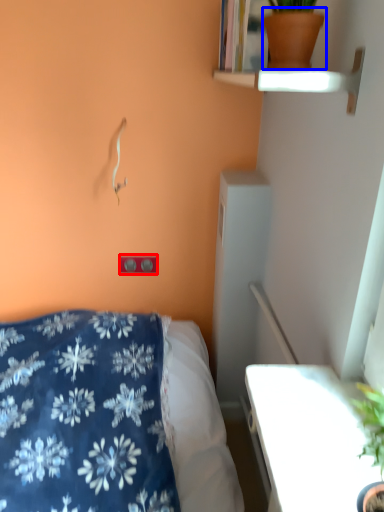
Question: Which point is further to the camera, electric outlet (highlighted by a red box) or flowerpot (highlighted by a blue box)?

Choices:
 (A) electric outlet
 (B) flowerpot

Answer: (A)